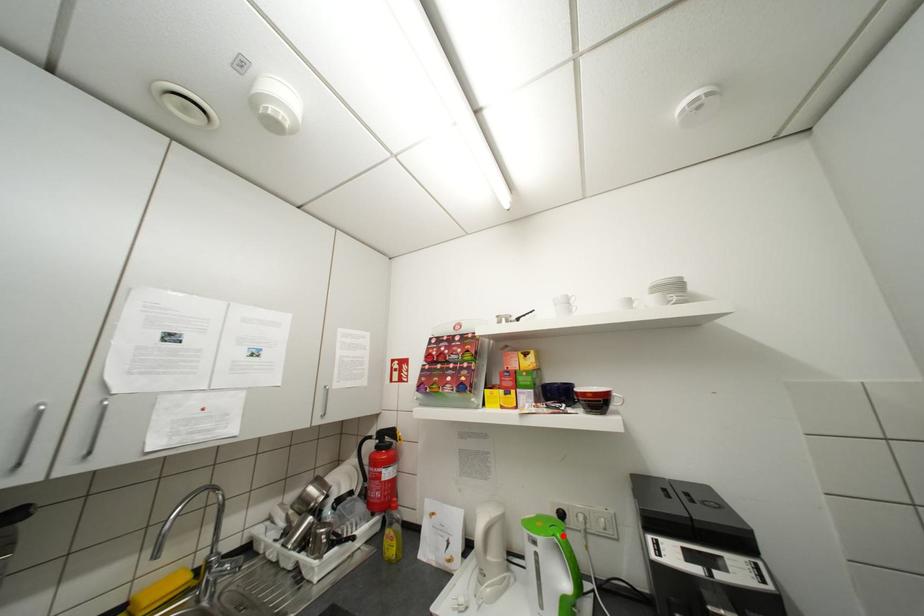
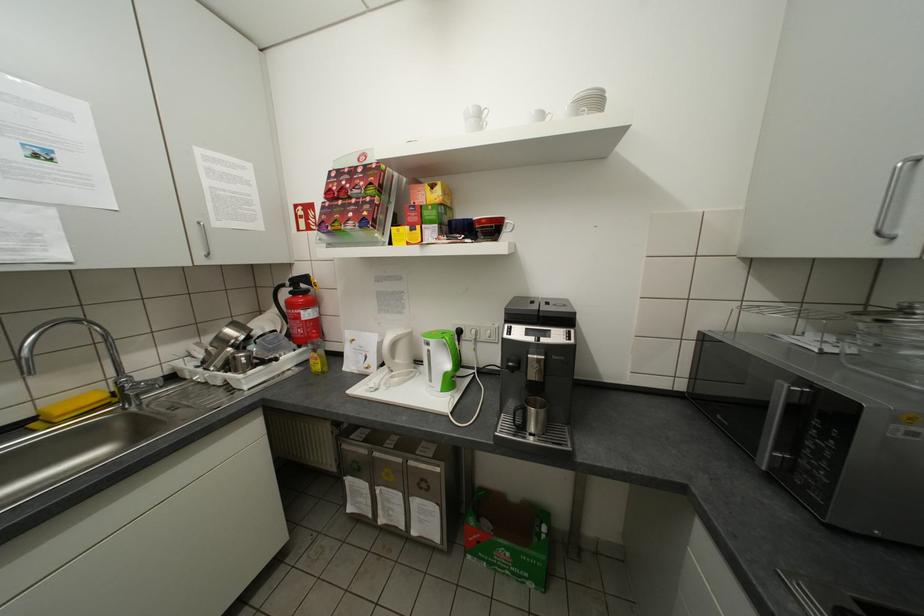
Locate, in the second image, the point that corresponds to the highlighted location in the first image.

(452, 338)